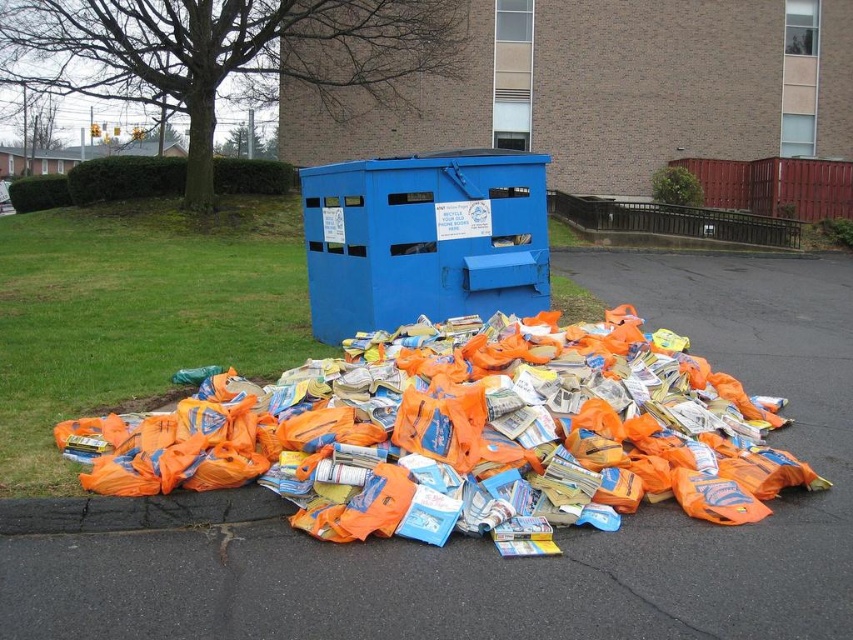
Question: Where is orange plastic bags at center located in relation to blue metallic dumpster at center in the image?

Choices:
 (A) above
 (B) below

Answer: (B)

Question: Is orange plastic bags at center below blue metallic dumpster at center?

Choices:
 (A) yes
 (B) no

Answer: (A)

Question: Which of the following is the closest to the observer?

Choices:
 (A) orange plastic bags at center
 (B) blue metallic dumpster at center

Answer: (A)

Question: Which point appears farthest from the camera in this image?

Choices:
 (A) (368, 200)
 (B) (379, 397)

Answer: (A)

Question: Which object is farther from the camera taking this photo?

Choices:
 (A) blue metallic dumpster at center
 (B) orange plastic bags at center

Answer: (A)

Question: Is orange plastic bags at center wider than blue metallic dumpster at center?

Choices:
 (A) no
 (B) yes

Answer: (B)